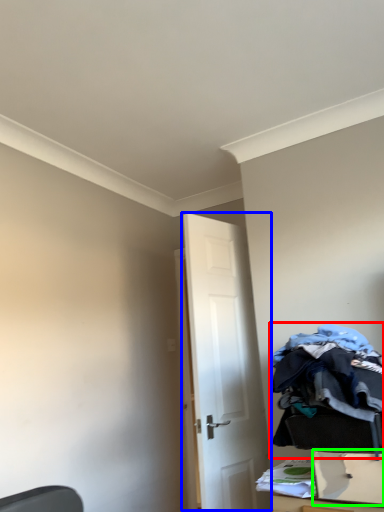
Question: Which object is the farthest from laundry (highlighted by a red box)? Choose among these: door (highlighted by a blue box) or drawer (highlighted by a green box).

Choices:
 (A) door
 (B) drawer

Answer: (A)